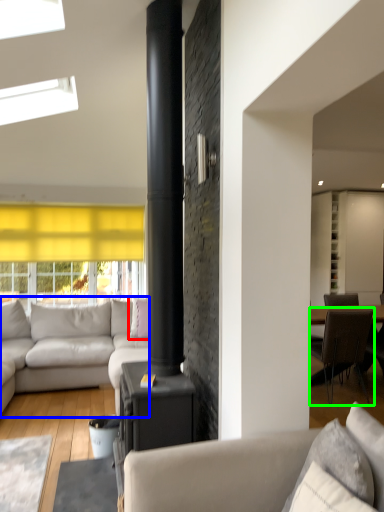
Question: Estimate the real-world distances between objects in this image. Which object is farther from pillow (highlighted by a red box), studio couch (highlighted by a blue box) or chair (highlighted by a green box)?

Choices:
 (A) studio couch
 (B) chair

Answer: (B)